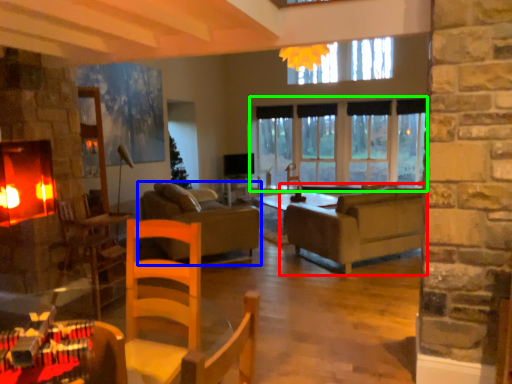
Question: Considering the real-world distances, which object is farthest from studio couch (highlighted by a red box)? studio couch (highlighted by a blue box) or window (highlighted by a green box)?

Choices:
 (A) studio couch
 (B) window

Answer: (A)